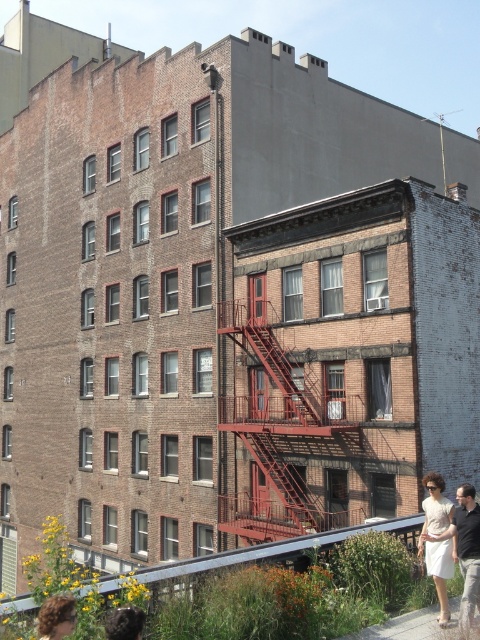
You are standing in the middle of the street looking at the two buildings. You see the rusty metal fire escape at center and the white cotton dress at lower right. Which object is closer to you?

The rusty metal fire escape at center is closer to you because it is further to the viewer than the white cotton dress at lower right.

You are a photographer standing in the middle of the street between the two buildings. You notice the rusty metal fire escape at center and the blonde hair at lower left. Which object is higher from the ground?

The rusty metal fire escape at center is taller than the blonde hair at lower left, so the fire escape is higher from the ground.

You are a delivery person standing at the blonde hair at lower left position. You need to deliver a package to the rusty metal fire escape at center. Can you walk directly to it without crossing any obstacles?

The rusty metal fire escape at center and blonde hair at lower left are 22.04 meters apart from each other. Since there are no obstacles mentioned in the scene description, you can walk directly to the rusty metal fire escape at center from the blonde hair at lower left position.